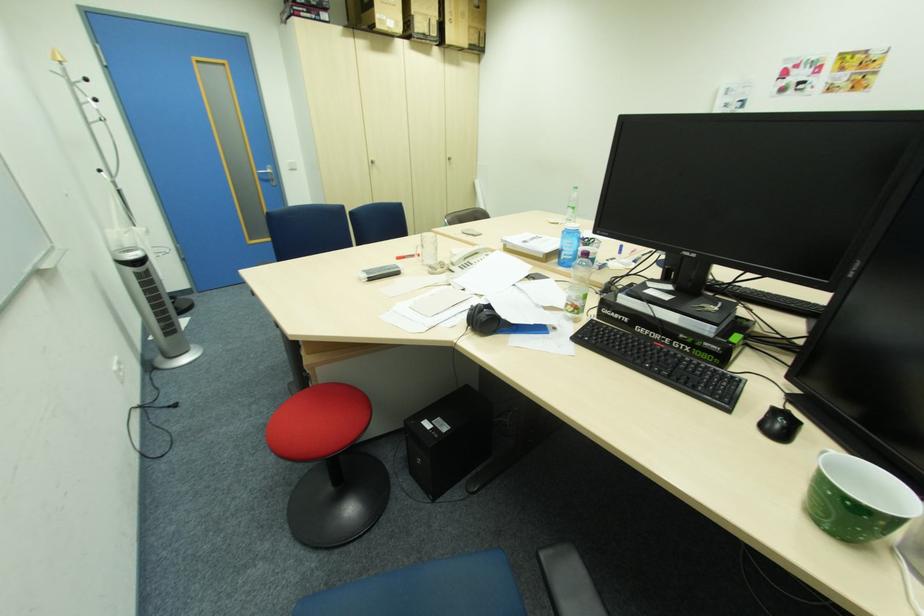
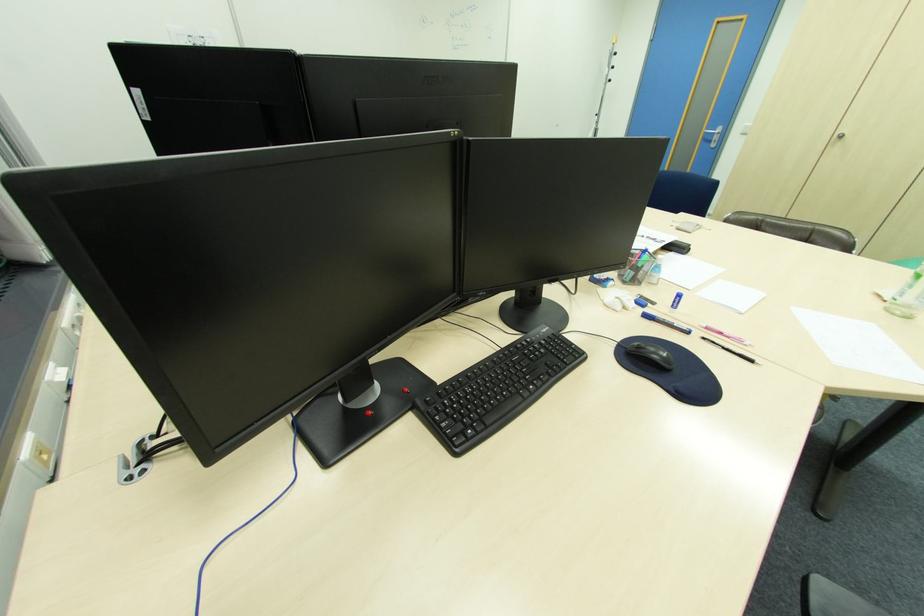
Where in the second image is the point corresponding to point (272, 177) from the first image?

(713, 139)